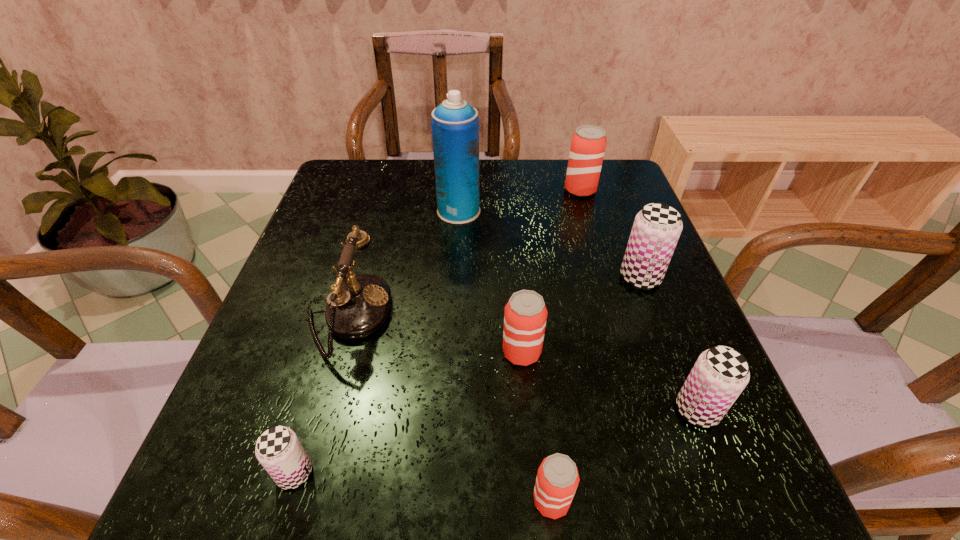
Where is `the tallest object`? the tallest object is located at coordinates (455, 123).

Locate an element on the screen. the third object from left to right is located at coordinates click(x=455, y=123).

Find the location of a particular element. the rightmost orange beer can is located at coordinates (588, 143).

The image size is (960, 540). I want to click on the farthest object, so click(x=588, y=143).

Image resolution: width=960 pixels, height=540 pixels. I want to click on the fifth nearest beer can, so click(x=657, y=227).

Locate an element on the screen. This screenshot has height=540, width=960. the farthest purple beer can is located at coordinates (657, 227).

Where is `black telephone`? black telephone is located at coordinates (358, 305).

This screenshot has width=960, height=540. In order to click on the second farthest orange beer can in this screenshot , I will do `click(525, 316)`.

Locate an element on the screen. Image resolution: width=960 pixels, height=540 pixels. the fourth nearest beer can is located at coordinates (525, 316).

The width and height of the screenshot is (960, 540). What are the coordinates of `the second nearest purple beer can` in the screenshot? It's located at 720,374.